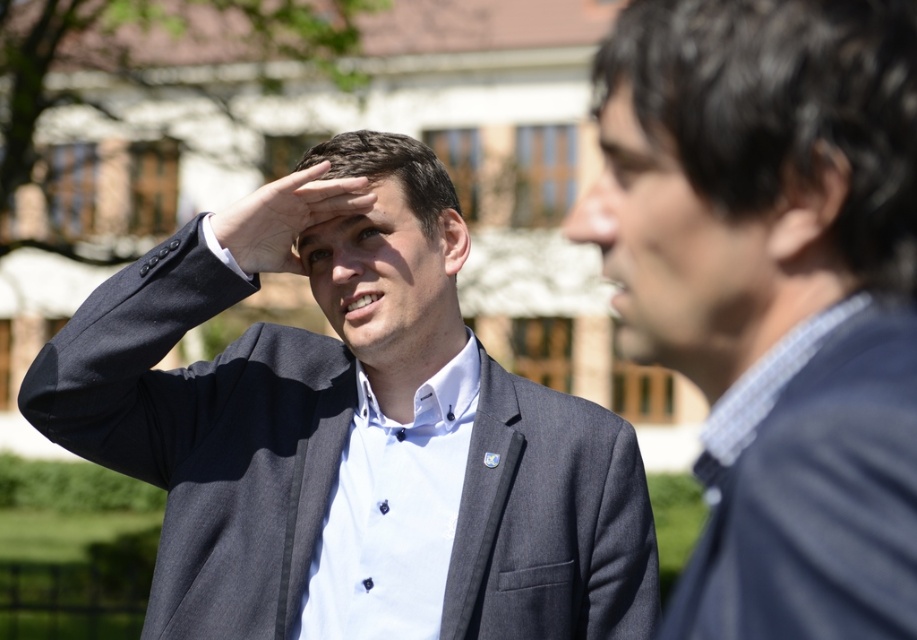
You are a photographer adjusting your camera settings to focus on the blue textured fabric at right and the brown matte eye at center. Which object should you focus on first if you want to capture both clearly in the same shot?

The blue textured fabric at right is in front of the brown matte eye at center, so you should focus on the blue textured fabric at right first to ensure both are in focus.

You are an observer standing in front of the scene. You see the blue textured fabric at right and the brown matte eye at center. Which object is positioned to the right side of the other?

The blue textured fabric at right is to the right of brown matte eye at center.

You are a photographer trying to capture a candid shot of both the matte gray suit at center and the dark brown hair at upper right. Since you want both subjects to be in focus, which one should you adjust your camera focus on first?

You should focus on the matte gray suit at center first because it is closer to you than the dark brown hair at upper right, ensuring both will be in focus when using depth of field.